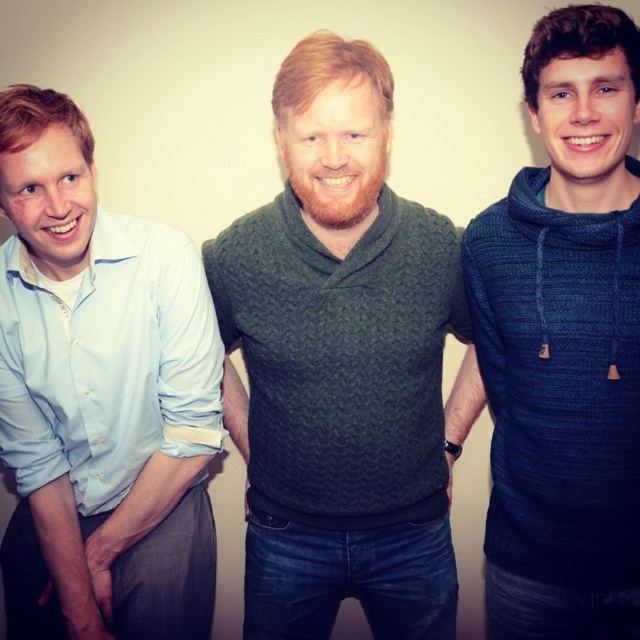
From the picture: Between dark green knitted sweater at center and dark blue knitted hoodie at center, which one is positioned lower?

dark blue knitted hoodie at center is below.

Can you confirm if dark green knitted sweater at center is wider than dark blue knitted hoodie at center?

Yes.

Is point (333, 461) behind point (532, 42)?

Yes, point (333, 461) is farther from viewer.

Locate an element on the screen. dark green knitted sweater at center is located at coordinates (339, 365).

Which is more to the right, dark green knitted sweater at center or light blue shirt at left?

dark green knitted sweater at center

Describe the element at coordinates (339, 365) in the screenshot. The image size is (640, 640). I see `dark green knitted sweater at center` at that location.

Where is `dark green knitted sweater at center`? The width and height of the screenshot is (640, 640). dark green knitted sweater at center is located at coordinates (339, 365).

Between light blue shirt at left and dark blue knitted hoodie at center, which one has less height?

With less height is light blue shirt at left.

This screenshot has height=640, width=640. What do you see at coordinates (99, 397) in the screenshot? I see `light blue shirt at left` at bounding box center [99, 397].

Locate an element on the screen. The image size is (640, 640). light blue shirt at left is located at coordinates (99, 397).